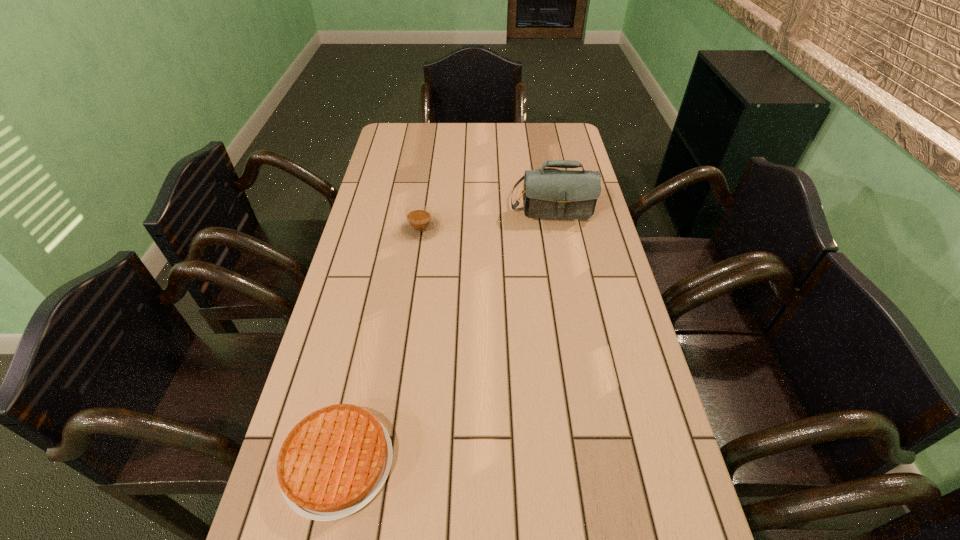
You are a GUI agent. You are given a task and a screenshot of the screen. Output one action in this format:
    pyautogui.click(x=<x>, y=<y>)
    Task: Click on the free spot between the cappuccino and the nearest object
    
    Given the screenshot: What is the action you would take?
    pyautogui.click(x=379, y=346)

You are a GUI agent. You are given a task and a screenshot of the screen. Output one action in this format:
    pyautogui.click(x=<x>, y=<y>)
    Task: Click on the vacant point located between the rightmost object and the cappuccino
    Image resolution: width=960 pixels, height=540 pixels.
    Given the screenshot: What is the action you would take?
    pyautogui.click(x=486, y=213)

You are a GUI agent. You are given a task and a screenshot of the screen. Output one action in this format:
    pyautogui.click(x=<x>, y=<y>)
    Task: Click on the vacant point located between the rightmost object and the pie
    The height and width of the screenshot is (540, 960).
    Given the screenshot: What is the action you would take?
    444,330

Identify the location of vacant space that is in between the rightmost object and the cappuccino. (486, 213).

The height and width of the screenshot is (540, 960). What are the coordinates of `free spot between the pie and the second shortest object` in the screenshot? It's located at (379, 346).

Image resolution: width=960 pixels, height=540 pixels. I want to click on object that can be found as the second closest to the pie, so click(549, 193).

Where is `the closest object to the rightmost object`? the closest object to the rightmost object is located at coordinates (419, 224).

The height and width of the screenshot is (540, 960). I want to click on free spot that satisfies the following two spatial constraints: 1. on the back side of the rightmost object; 2. on the left side of the nearest object, so click(x=396, y=198).

Locate an element on the screen. This screenshot has height=540, width=960. free space that satisfies the following two spatial constraints: 1. on the back side of the tallest object; 2. on the right side of the pie is located at coordinates (396, 198).

I want to click on free space that satisfies the following two spatial constraints: 1. on the back side of the rightmost object; 2. on the left side of the cappuccino, so click(425, 198).